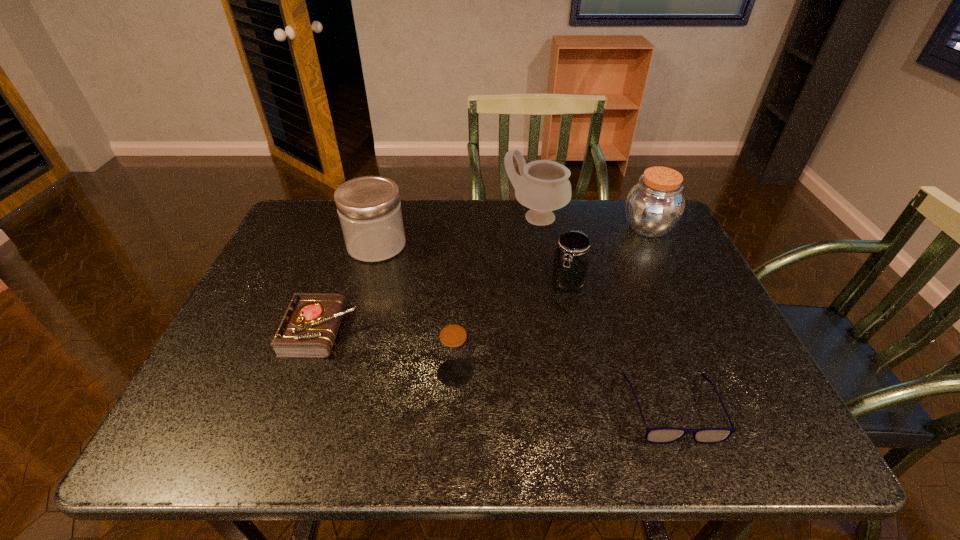
This screenshot has height=540, width=960. Find the location of `free space between the rightmost jar and the spectacles`. free space between the rightmost jar and the spectacles is located at coordinates (660, 318).

At what (x,y) coordinates should I click in order to perform the action: click on free spot between the fifth object from right to left and the rightmost jar. Please return your answer as a coordinate pair (x, y). This screenshot has width=960, height=540. Looking at the image, I should click on (552, 300).

Identify the location of vacant region between the fourth farthest object and the second jar from left to right. (512, 328).

You are a GUI agent. You are given a task and a screenshot of the screen. Output one action in this format:
    pyautogui.click(x=<x>, y=<y>)
    Task: Click on the vacant area that lies between the rightmost jar and the pottery
    
    Given the screenshot: What is the action you would take?
    pyautogui.click(x=591, y=222)

Find the location of `vacant area that lies between the pottery and the rightmost jar`. vacant area that lies between the pottery and the rightmost jar is located at coordinates (591, 222).

Locate an element on the screen. The image size is (960, 540). free space between the third jar from left to right and the fifth farthest object is located at coordinates (445, 306).

Identify the location of vacant area that lies between the fifth farthest object and the spectacles. Image resolution: width=960 pixels, height=540 pixels. [497, 369].

Locate an element on the screen. This screenshot has height=540, width=960. free space between the third nearest object and the third farthest jar is located at coordinates (445, 306).

Locate which object is the fourth closest to the diary. Please provide its 2D coordinates. Your answer should be formatted as a tuple, i.e. [(x, y)], where the tuple contains the x and y coordinates of a point satisfying the conditions above.

[(570, 266)]

Locate which object ranks fourth in proximity to the spectacles. Please provide its 2D coordinates. Your answer should be formatted as a tuple, i.e. [(x, y)], where the tuple contains the x and y coordinates of a point satisfying the conditions above.

[(543, 186)]